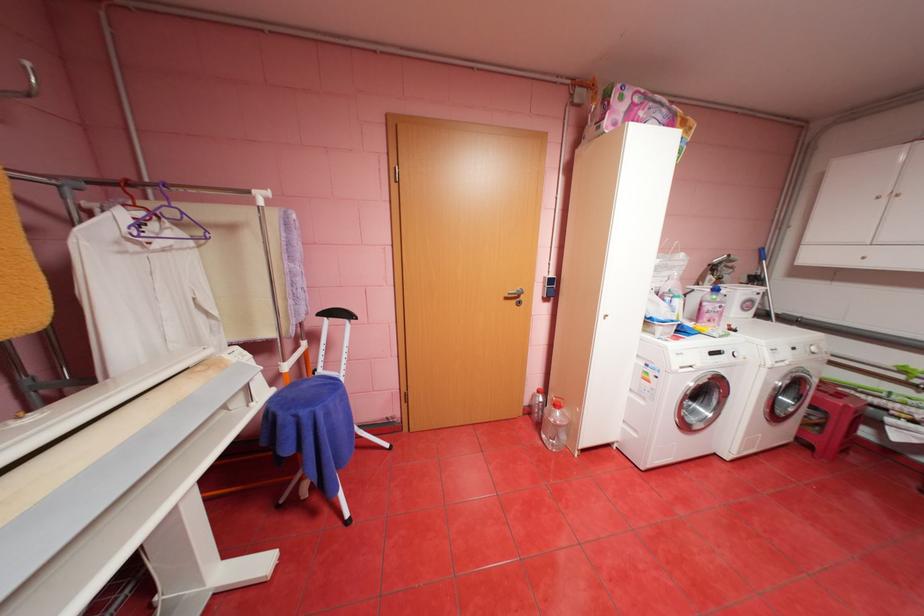
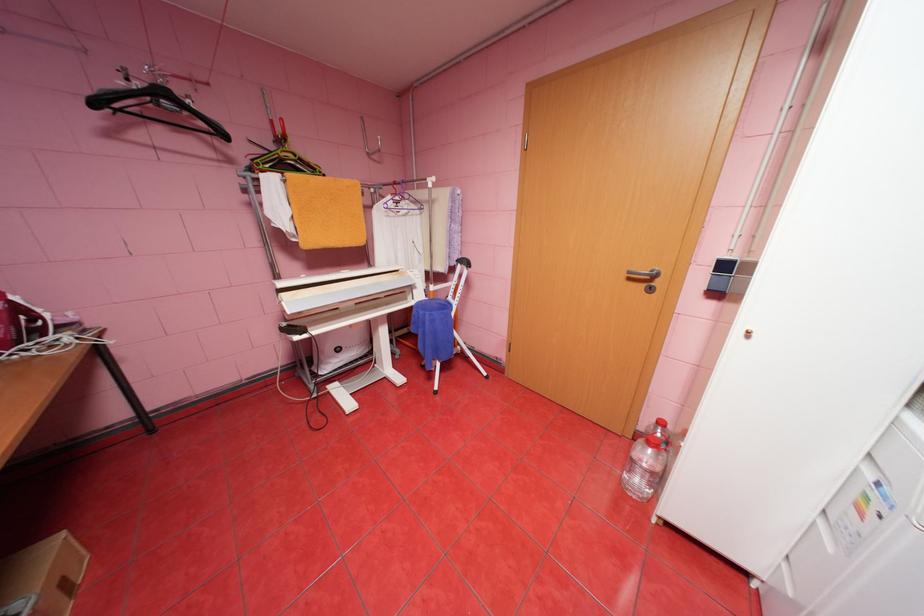
Find the pixel in the second image that matches (x=523, y=301) in the first image.

(650, 285)